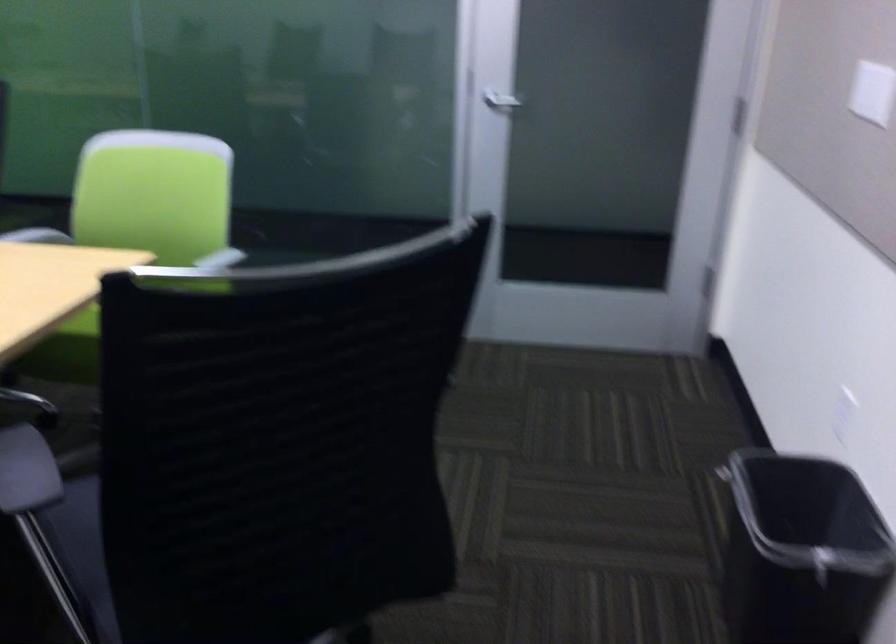
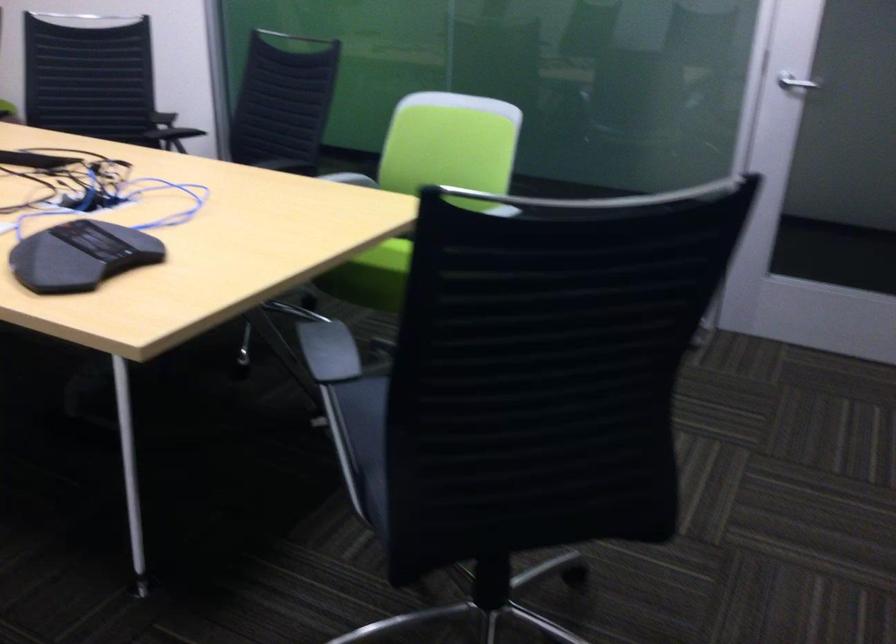
Question: Based on the continuous images, in which direction is the camera rotating? Reply with the corresponding letter.

Choices:
 (A) Left
 (B) Right
 (C) Up
 (D) Down

Answer: (A)